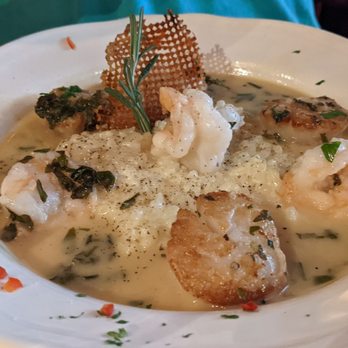
Locate an element on the screen. The width and height of the screenshot is (348, 348). blue tablecloth is located at coordinates (239, 9).